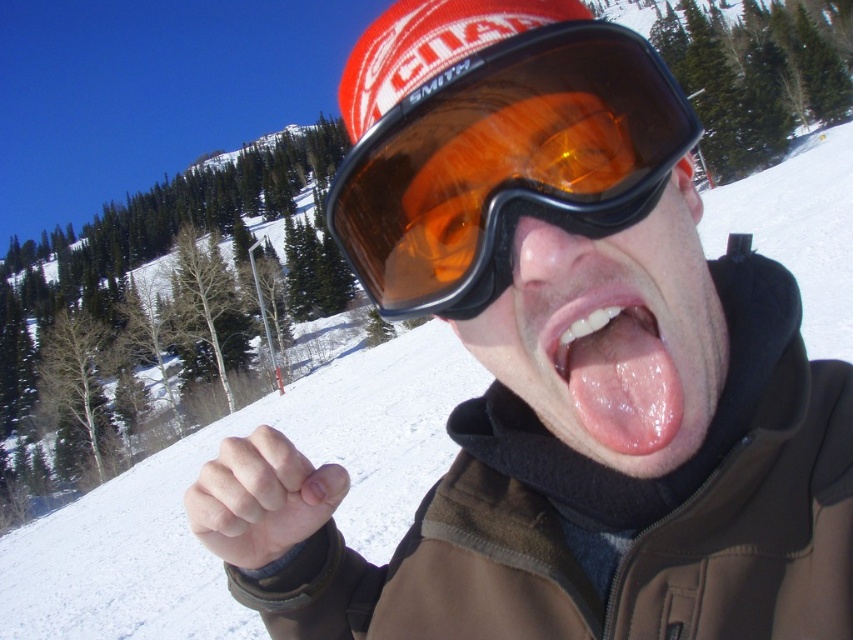
Question: Is orange tinted plastic goggles at center further to camera compared to matte black goggles at center?

Choices:
 (A) yes
 (B) no

Answer: (A)

Question: Among these points, which one is farthest from the camera?

Choices:
 (A) (659, 216)
 (B) (552, 344)

Answer: (A)

Question: Which point appears closest to the camera in this image?

Choices:
 (A) (688, 145)
 (B) (616, 376)

Answer: (B)

Question: Which object is closer to the camera taking this photo?

Choices:
 (A) matte black goggles at center
 (B) pink smooth tongue at center

Answer: (A)

Question: Does orange tinted plastic goggles at center appear over matte black goggles at center?

Choices:
 (A) yes
 (B) no

Answer: (A)

Question: Observing the image, what is the correct spatial positioning of orange tinted plastic goggles at center in reference to pink smooth tongue at center?

Choices:
 (A) above
 (B) below

Answer: (A)